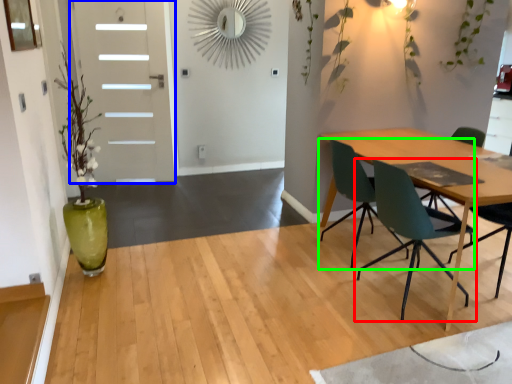
Question: Which object is positioned farthest from chair (highlighted by a red box)? Select from door (highlighted by a blue box) and chair (highlighted by a green box).

Choices:
 (A) door
 (B) chair

Answer: (A)